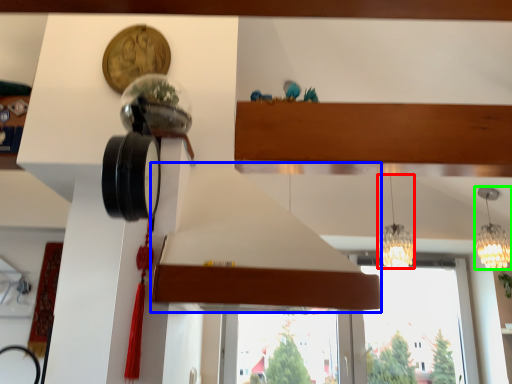
Question: Based on their relative distances, which object is nearer to lamp (highlighted by a red box)? Choose from exhaust hood (highlighted by a blue box) and lamp (highlighted by a green box).

Choices:
 (A) exhaust hood
 (B) lamp

Answer: (B)